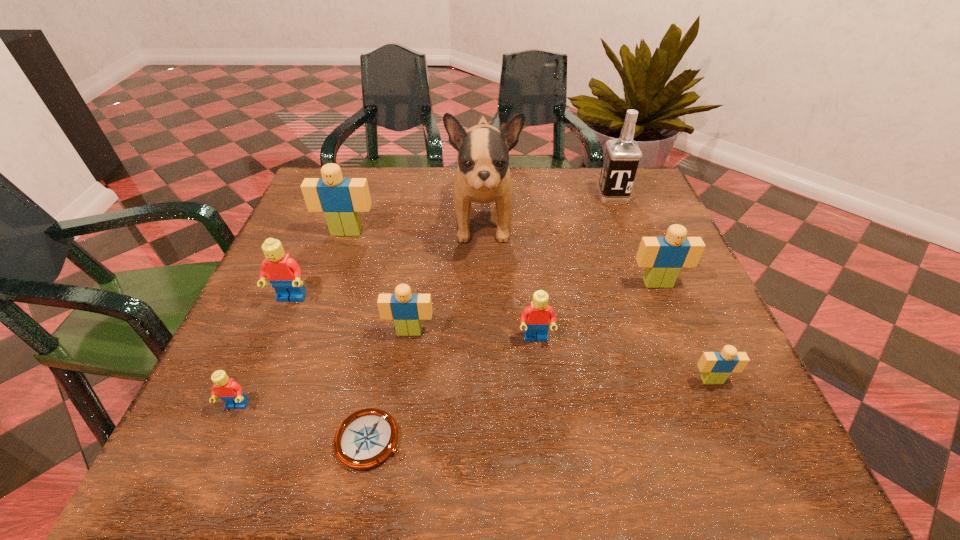
This screenshot has height=540, width=960. Identify the location of vodka that is at the right edge. (622, 155).

Find the location of a particular element. The image size is (960, 540). object that is at the far right corner is located at coordinates (622, 155).

In the image, there is a desktop. At what (x,y) coordinates should I click in order to perform the action: click on vacant space at the far edge. Please return your answer as a coordinate pair (x, y). This screenshot has height=540, width=960. Looking at the image, I should click on (518, 178).

This screenshot has height=540, width=960. Find the location of `free space at the near edge of the desktop`. free space at the near edge of the desktop is located at coordinates (500, 443).

In the image, there is a desktop. At what (x,y) coordinates should I click in order to perform the action: click on vacant space at the left edge. Please return your answer as a coordinate pair (x, y). Looking at the image, I should click on (327, 320).

At what (x,y) coordinates should I click in order to perform the action: click on vacant point at the right edge. Please return your answer as a coordinate pair (x, y). This screenshot has height=540, width=960. Looking at the image, I should click on (629, 227).

The image size is (960, 540). In the image, there is a desktop. Find the location of `vacant space at the far right corner`. vacant space at the far right corner is located at coordinates (600, 205).

The image size is (960, 540). I want to click on free space between the shortest object and the tallest object, so click(x=427, y=329).

The height and width of the screenshot is (540, 960). Find the location of `free space between the eighth farthest object and the fifth nearest Lego`. free space between the eighth farthest object and the fifth nearest Lego is located at coordinates (501, 340).

Image resolution: width=960 pixels, height=540 pixels. I want to click on free space between the puppy and the biggest beige Lego, so (x=415, y=225).